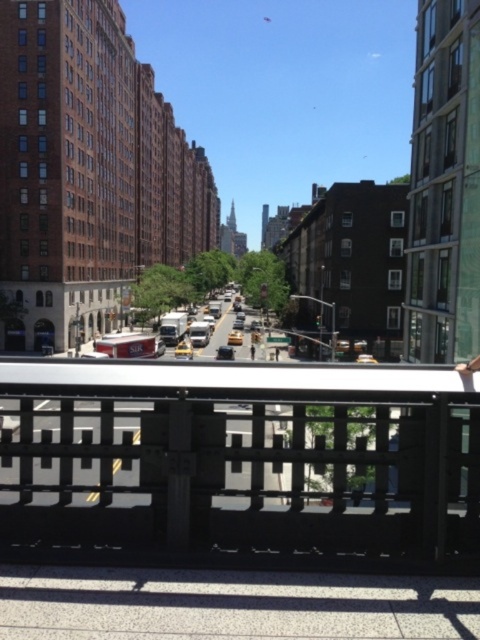
Question: Is black metal fence at lower center wider than gray concrete pavement at lower center?

Choices:
 (A) no
 (B) yes

Answer: (B)

Question: Does black metal fence at lower center appear under gray concrete pavement at lower center?

Choices:
 (A) no
 (B) yes

Answer: (B)

Question: Among these objects, which one is farthest from the camera?

Choices:
 (A) black metal fence at lower center
 (B) gray concrete pavement at lower center

Answer: (A)

Question: Considering the relative positions of black metal fence at lower center and gray concrete pavement at lower center in the image provided, where is black metal fence at lower center located with respect to gray concrete pavement at lower center?

Choices:
 (A) left
 (B) right

Answer: (A)

Question: Among these objects, which one is farthest from the camera?

Choices:
 (A) gray concrete pavement at lower center
 (B) black metal fence at lower center

Answer: (B)